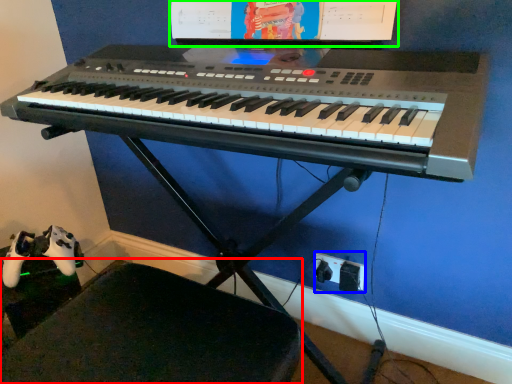
Question: Which object is the farthest from swivel chair (highlighted by a red box)? Choose among these: plug (highlighted by a blue box) or computer monitor (highlighted by a green box).

Choices:
 (A) plug
 (B) computer monitor

Answer: (B)